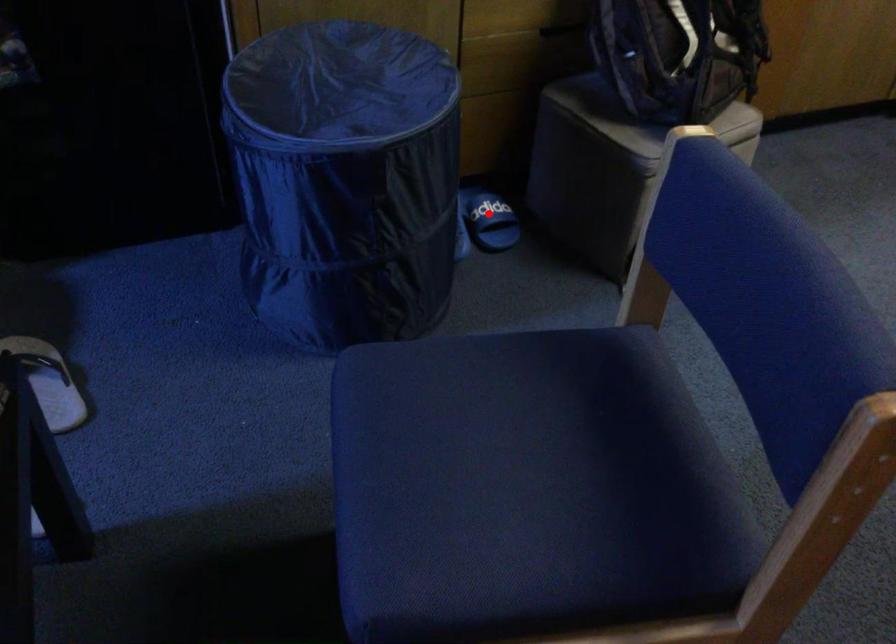
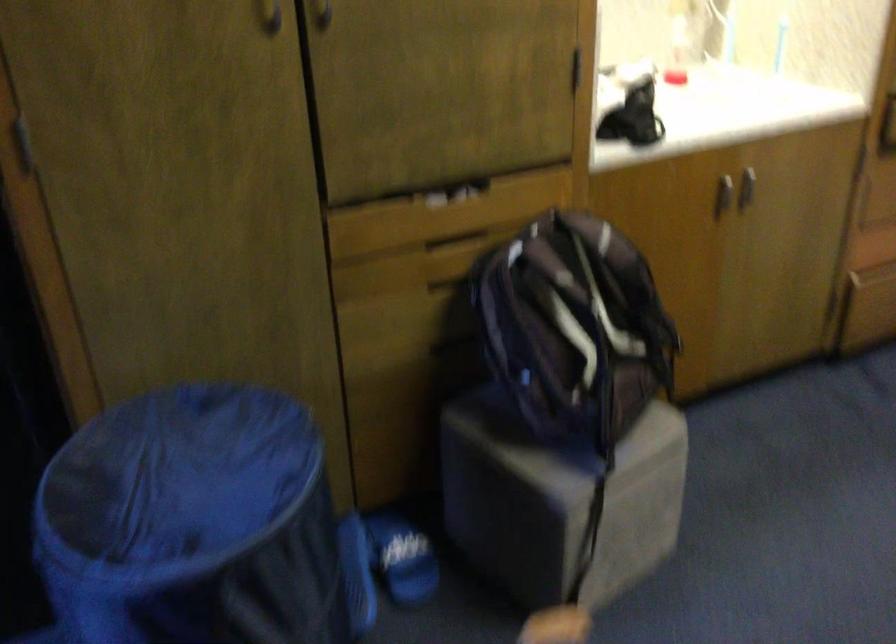
In the second image, find the point that corresponds to the highlighted location in the first image.

(401, 558)